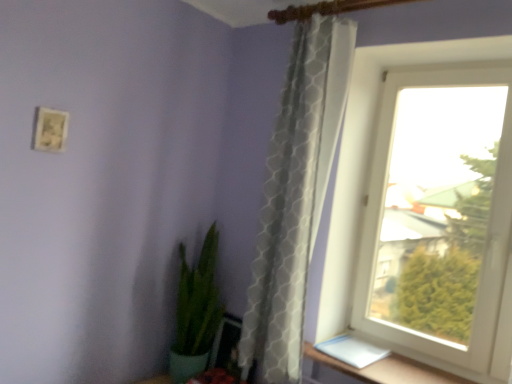
What do you see at coordinates (296, 195) in the screenshot? I see `white textured curtain at right` at bounding box center [296, 195].

What is the approximate height of white plastic window at upper right?

The height of white plastic window at upper right is 1.46 meters.

Describe the element at coordinates (379, 370) in the screenshot. Image resolution: width=512 pixels, height=384 pixels. I see `brown wooden window sill at lower right` at that location.

Identify the location of brown wooden window sill at lower right. (379, 370).

Find the location of a particular element. This screenshot has height=384, width=512. matte white picture frame at upper left is located at coordinates (50, 130).

Would you say green glossy plant at lower left is part of white textured curtain at right's contents?

No.

Which is behind, point (269, 297) or point (177, 345)?

Positioned behind is point (177, 345).

Is white textured curtain at right oriented away from green glossy plant at lower left?

white textured curtain at right is not turned away from green glossy plant at lower left.

From a real-world perspective, is green glossy plant at lower left physically located above or below white plastic window at upper right?

From a real-world perspective, green glossy plant at lower left is physically below white plastic window at upper right.

Can you tell me how much green glossy plant at lower left and white plastic window at upper right differ in facing direction?

The angle between the facing direction of green glossy plant at lower left and the facing direction of white plastic window at upper right is 2.6 degrees.

Is white plastic window at upper right located within green glossy plant at lower left?

No, white plastic window at upper right is not a part of green glossy plant at lower left.

In terms of width, does green glossy plant at lower left look wider or thinner when compared to white plastic window at upper right?

Clearly, green glossy plant at lower left has more width compared to white plastic window at upper right.

Looking at this image, would you say brown wooden window sill at lower right is inside or outside green glossy plant at lower left?

brown wooden window sill at lower right is outside green glossy plant at lower left.

Visually, is brown wooden window sill at lower right positioned to the left or to the right of green glossy plant at lower left?

Clearly, brown wooden window sill at lower right is on the right of green glossy plant at lower left in the image.

Is brown wooden window sill at lower right closer to camera compared to green glossy plant at lower left?

That is True.

Can you tell me how much brown wooden window sill at lower right and green glossy plant at lower left differ in facing direction?

They differ by 2.77 degrees in their facing directions.

Who is taller, green glossy plant at lower left or white textured curtain at right?

white textured curtain at right.

Does green glossy plant at lower left have a larger size compared to white textured curtain at right?

Yes, green glossy plant at lower left is bigger than white textured curtain at right.

Is green glossy plant at lower left facing towards white textured curtain at right?

No, green glossy plant at lower left does not turn towards white textured curtain at right.

Measure the distance between green glossy plant at lower left and white textured curtain at right.

green glossy plant at lower left is 25.12 inches from white textured curtain at right.

From the image's perspective, is green glossy plant at lower left above or below matte white picture frame at upper left?

green glossy plant at lower left is situated lower than matte white picture frame at upper left in the image.

Does green glossy plant at lower left have a lesser width compared to matte white picture frame at upper left?

No.

Based on the photo, which is more to the right, green glossy plant at lower left or matte white picture frame at upper left?

Positioned to the right is green glossy plant at lower left.

Is green glossy plant at lower left in contact with matte white picture frame at upper left?

No, green glossy plant at lower left is not in contact with matte white picture frame at upper left.

Does white textured curtain at right have a greater width compared to matte white picture frame at upper left?

Yes, white textured curtain at right is wider than matte white picture frame at upper left.

Is white textured curtain at right shorter than matte white picture frame at upper left?

No, white textured curtain at right is not shorter than matte white picture frame at upper left.

Consider the image. From the image's perspective, which is below, white textured curtain at right or matte white picture frame at upper left?

From the image's view, white textured curtain at right is below.

You are a GUI agent. You are given a task and a screenshot of the screen. Output one action in this format:
    pyautogui.click(x=<x>, y=<y>)
    Task: Click on the picture frame to the left of white textured curtain at right
    This screenshot has width=512, height=384.
    Given the screenshot: What is the action you would take?
    pyautogui.click(x=50, y=130)

Considering the positions of points (267, 312) and (346, 371), is point (267, 312) closer to camera compared to point (346, 371)?

No, (267, 312) is behind (346, 371).

From a real-world perspective, between white textured curtain at right and brown wooden window sill at lower right, who is vertically lower?

In real-world perspective, brown wooden window sill at lower right is lower.

Is white textured curtain at right outside of brown wooden window sill at lower right?

Yes, white textured curtain at right is located beyond the bounds of brown wooden window sill at lower right.

Does white textured curtain at right have a greater height compared to brown wooden window sill at lower right?

Yes, white textured curtain at right is taller than brown wooden window sill at lower right.

Find the location of a particular element. curtain that appears in front of the green glossy plant at lower left is located at coordinates (296, 195).

The height and width of the screenshot is (384, 512). Identify the location of houseplant on the left of white plastic window at upper right. (196, 311).

Looking at this image, considering their positions, is green glossy plant at lower left positioned closer to matte white picture frame at upper left than white plastic window at upper right?

Based on the image, green glossy plant at lower left appears to be nearer to matte white picture frame at upper left.

Looking at the image, which one is located further to brown wooden window sill at lower right, green glossy plant at lower left or white textured curtain at right?

green glossy plant at lower left lies further to brown wooden window sill at lower right than the other object.

Which object lies further to the anchor point green glossy plant at lower left, brown wooden window sill at lower right or matte white picture frame at upper left?

matte white picture frame at upper left is further to green glossy plant at lower left.

From the image, which object appears to be farther from white textured curtain at right, white plastic window at upper right or matte white picture frame at upper left?

matte white picture frame at upper left is further to white textured curtain at right.

Estimate the real-world distances between objects in this image. Which object is closer to green glossy plant at lower left, white textured curtain at right or matte white picture frame at upper left?

Based on the image, white textured curtain at right appears to be nearer to green glossy plant at lower left.

Based on their spatial positions, is brown wooden window sill at lower right or green glossy plant at lower left further from matte white picture frame at upper left?

brown wooden window sill at lower right lies further to matte white picture frame at upper left than the other object.

Considering their positions, is white plastic window at upper right positioned further to white textured curtain at right than brown wooden window sill at lower right?

Based on the image, brown wooden window sill at lower right appears to be further to white textured curtain at right.

Estimate the real-world distances between objects in this image. Which object is closer to brown wooden window sill at lower right, white textured curtain at right or green glossy plant at lower left?

white textured curtain at right is positioned closer to the anchor brown wooden window sill at lower right.

Where is `houseplant between matte white picture frame at upper left and white textured curtain at right in the horizontal direction`? houseplant between matte white picture frame at upper left and white textured curtain at right in the horizontal direction is located at coordinates (196, 311).

This screenshot has height=384, width=512. In order to click on curtain located between green glossy plant at lower left and white plastic window at upper right in the left-right direction in this screenshot , I will do `click(296, 195)`.

Identify the location of curtain located between green glossy plant at lower left and brown wooden window sill at lower right in the left-right direction. (296, 195).

Where is `window between white textured curtain at right and brown wooden window sill at lower right vertically`? The image size is (512, 384). window between white textured curtain at right and brown wooden window sill at lower right vertically is located at coordinates (439, 228).